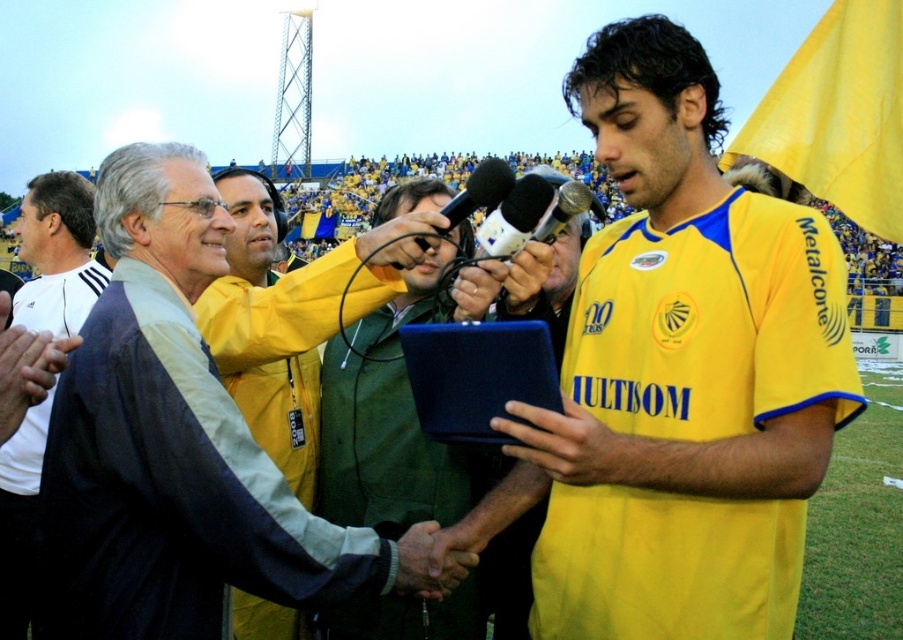
You are standing at the point labeled point (x=550, y=317) and want to walk towards the point labeled point (x=23, y=637). Which direction should you face to walk directly towards it?

Since point (x=550, y=317) is closer to the viewer than point (x=23, y=637), you should face downward and slightly to the right to walk directly towards it.

You are a photographer at the event and need to capture a photo where the green fabric jacket at center and the white fabric shirt at center are clearly visible. Based on their positions, which one should you focus on first to ensure both are in frame?

The green fabric jacket at center is below the white fabric shirt at center, so focusing on the white fabric shirt at center first will ensure both are in frame as the jacket is positioned lower.

You are a photographer at the sports event. You need to capture a photo where the white fabric shirt at center and the white plastic microphone at center are both visible. Based on their positions, which object should you focus on first to ensure both are in frame?

The white fabric shirt at center is located below the white plastic microphone at center. To ensure both are in frame, focus on the white plastic microphone at center first since it is higher up, allowing the shirt to naturally fall into the shot below.